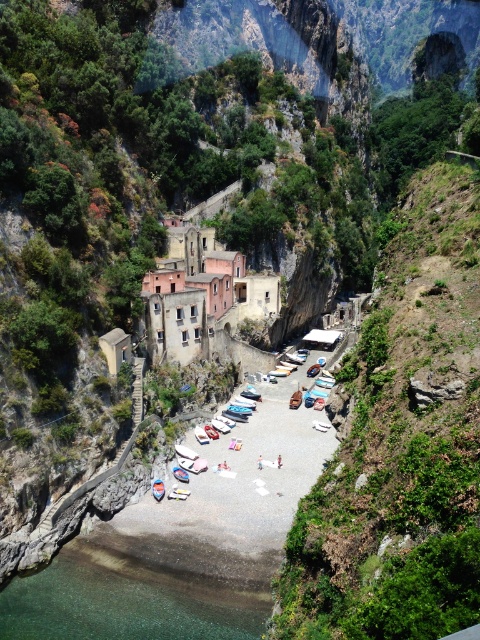
Question: Which point is closer to the camera taking this photo?

Choices:
 (A) (261, 454)
 (B) (6, 596)
 (C) (153, 481)

Answer: (B)

Question: Is clear glass water at lower left bigger than white fabric person at center?

Choices:
 (A) no
 (B) yes

Answer: (B)

Question: Does white glossy boat at center appear under light blue denim shorts at center?

Choices:
 (A) no
 (B) yes

Answer: (B)

Question: Which object is closer to the camera taking this photo?

Choices:
 (A) white fabric person at center
 (B) white glossy boat at center
 (C) light blue denim shorts at center
 (D) clear glass water at lower left

Answer: (D)

Question: In this image, where is clear glass water at lower left located relative to light blue denim shorts at center?

Choices:
 (A) below
 (B) above

Answer: (A)

Question: Among these points, which one is farthest from the camera?

Choices:
 (A) (231, 637)
 (B) (156, 497)

Answer: (B)